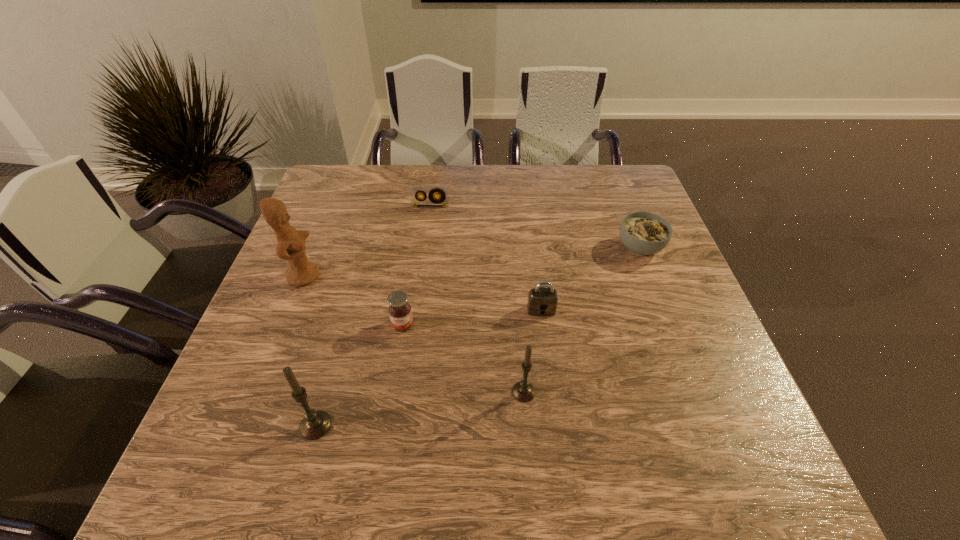
At what (x,y) coordinates should I click in order to perform the action: click on the nearer candle. Please return your answer as a coordinate pair (x, y). The image size is (960, 540). Looking at the image, I should click on (315, 424).

This screenshot has width=960, height=540. I want to click on the nearest object, so click(315, 424).

Locate an element on the screen. The image size is (960, 540). the farther candle is located at coordinates (523, 391).

Locate an element on the screen. The height and width of the screenshot is (540, 960). the shorter candle is located at coordinates (523, 391).

The image size is (960, 540). In order to click on soup bowl in this screenshot , I will do `click(643, 233)`.

At what (x,y) coordinates should I click in order to perform the action: click on videotape. Please return your answer as a coordinate pair (x, y). This screenshot has height=540, width=960. Looking at the image, I should click on (415, 191).

Identify the location of figurine. (290, 246).

Find the location of a particular element. the tallest object is located at coordinates (290, 246).

Image resolution: width=960 pixels, height=540 pixels. I want to click on jam, so click(x=400, y=312).

The image size is (960, 540). I want to click on the second object from right to left, so (542, 301).